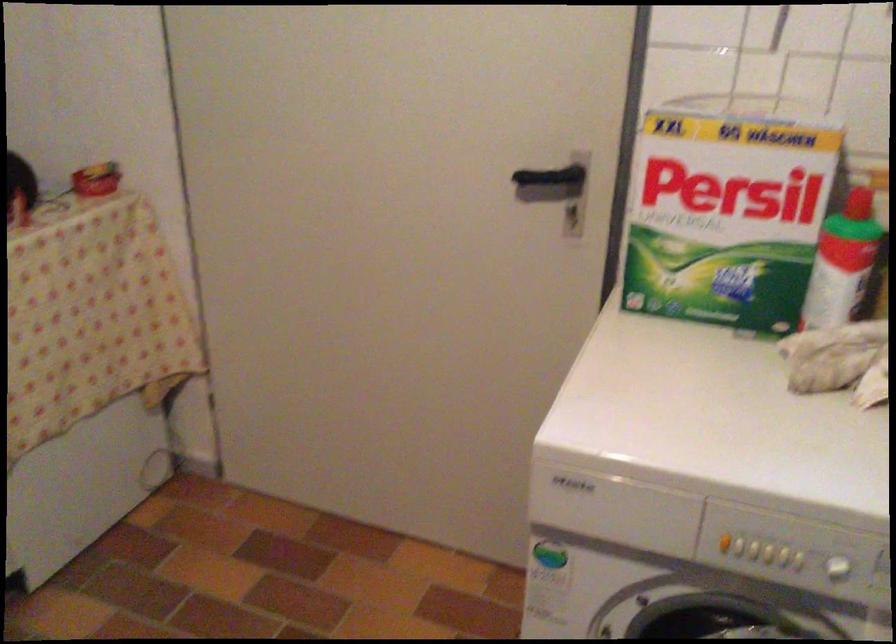
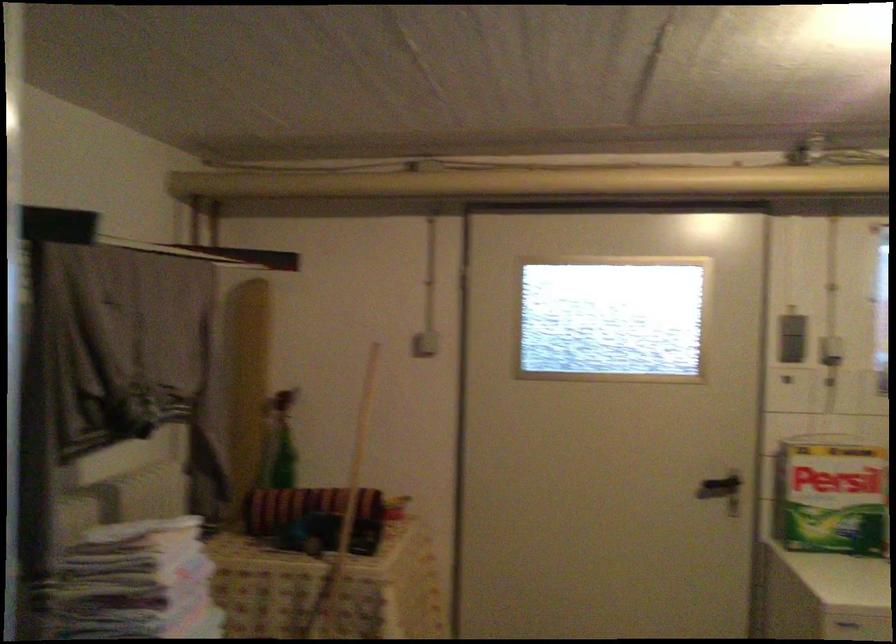
Locate, in the second image, the point that corresponds to [707,218] in the first image.

(831, 496)